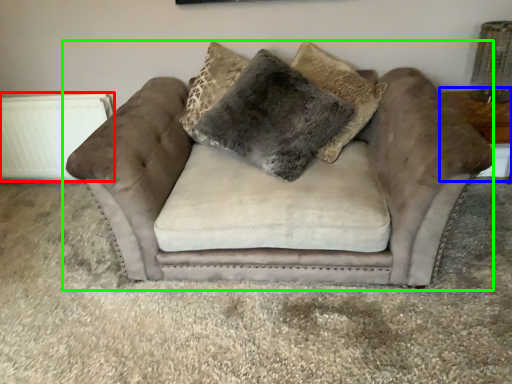
Question: Considering the real-world distances, which object is closest to radiator (highlighted by a red box)? table (highlighted by a blue box) or studio couch (highlighted by a green box).

Choices:
 (A) table
 (B) studio couch

Answer: (B)